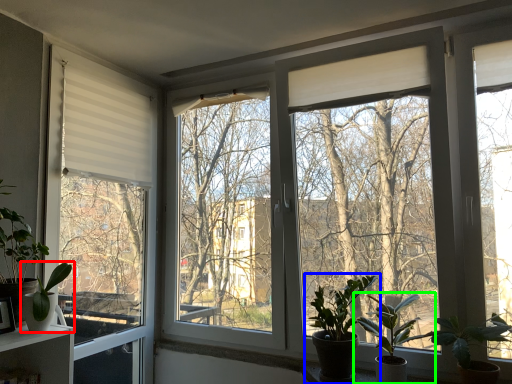
Question: Based on their relative distances, which object is nearer to houseplant (highlighted by a red box)? Choose from houseplant (highlighted by a blue box) and houseplant (highlighted by a green box).

Choices:
 (A) houseplant
 (B) houseplant

Answer: (A)